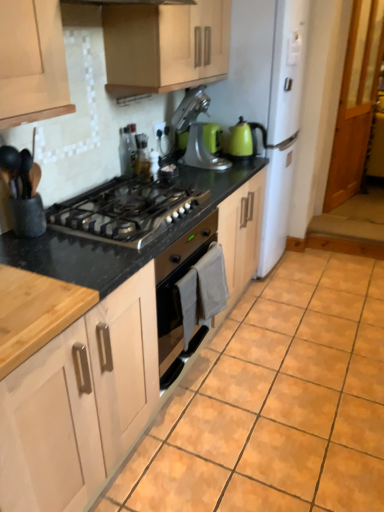
Question: Which direction should I rotate to face satin silver toaster at upper center, the third appliance viewed from the right, — up or down?

Choices:
 (A) up
 (B) down

Answer: (A)

Question: From a real-world perspective, is green matte stand mixer at center, which is the 1th appliance from right to left, located beneath stainless steel gas stove at center?

Choices:
 (A) no
 (B) yes

Answer: (A)

Question: Is green matte stand mixer at center, the 1th appliance from the back, far from stainless steel gas stove at center?

Choices:
 (A) no
 (B) yes

Answer: (A)

Question: Does green matte stand mixer at center, which is the 1th appliance from right to left, have a greater height compared to stainless steel gas stove at center?

Choices:
 (A) no
 (B) yes

Answer: (B)

Question: From a real-world perspective, is green matte stand mixer at center, the 3th appliance from the left, on stainless steel gas stove at center?

Choices:
 (A) yes
 (B) no

Answer: (A)

Question: Does green matte stand mixer at center, the 1th appliance from the back, have a lesser height compared to stainless steel gas stove at center?

Choices:
 (A) yes
 (B) no

Answer: (B)

Question: Is green matte stand mixer at center, which is the 1th appliance from right to left, directly adjacent to stainless steel gas stove at center?

Choices:
 (A) no
 (B) yes

Answer: (A)

Question: Does stainless steel gas stove at center have a greater height compared to metallic silver stand mixer at upper center?

Choices:
 (A) no
 (B) yes

Answer: (A)

Question: Is stainless steel gas stove at center positioned beyond the bounds of metallic silver stand mixer at upper center?

Choices:
 (A) yes
 (B) no

Answer: (A)

Question: From a real-world perspective, is stainless steel gas stove at center below metallic silver stand mixer at upper center?

Choices:
 (A) yes
 (B) no

Answer: (A)

Question: Does stainless steel gas stove at center come behind metallic silver stand mixer at upper center?

Choices:
 (A) yes
 (B) no

Answer: (B)

Question: Does stainless steel gas stove at center have a lesser width compared to metallic silver stand mixer at upper center?

Choices:
 (A) yes
 (B) no

Answer: (B)

Question: Can you confirm if stainless steel gas stove at center is wider than metallic silver stand mixer at upper center?

Choices:
 (A) yes
 (B) no

Answer: (A)

Question: Is translucent glass bottle at upper center, which is counted as the 3th appliance, starting from the back, smaller than stainless steel gas stove at center?

Choices:
 (A) no
 (B) yes

Answer: (B)